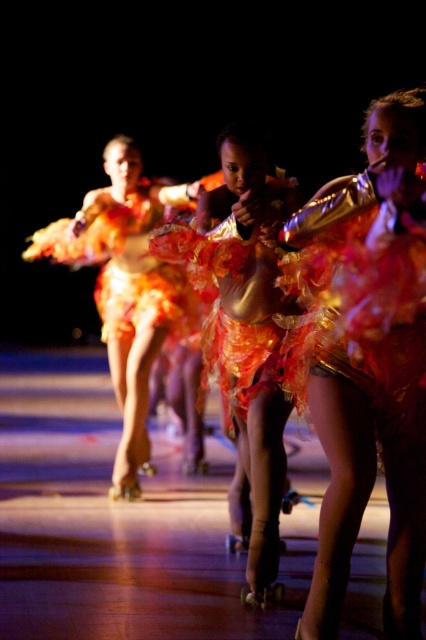
Question: Does shiny metallic skirt at center have a greater width compared to shiny orange fabric at center?

Choices:
 (A) yes
 (B) no

Answer: (B)

Question: Estimate the real-world distances between objects in this image. Which object is closer to the shiny orange fabric dress at center?

Choices:
 (A) shiny orange fabric skirt at center
 (B) shiny orange fabric at center

Answer: (B)

Question: Is shiny orange fabric skirt at center closer to camera compared to shiny orange fabric at center?

Choices:
 (A) no
 (B) yes

Answer: (B)

Question: Does shiny metallic skirt at center have a greater width compared to shiny orange fabric skirt at center?

Choices:
 (A) no
 (B) yes

Answer: (B)

Question: Among these objects, which one is farthest from the camera?

Choices:
 (A) shiny orange fabric dress at center
 (B) shiny metallic skirt at center
 (C) shiny orange fabric skirt at center

Answer: (A)

Question: Which of the following is the farthest from the observer?

Choices:
 (A) shiny orange fabric at center
 (B) shiny metallic skirt at center
 (C) shiny orange fabric dress at center

Answer: (C)